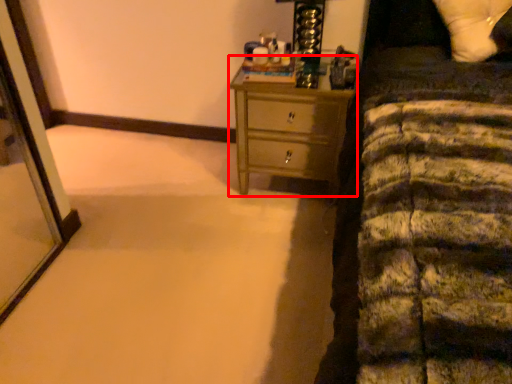
Question: Where is chest of drawers (annotated by the red box) located in relation to pillow in the image?

Choices:
 (A) left
 (B) right

Answer: (A)